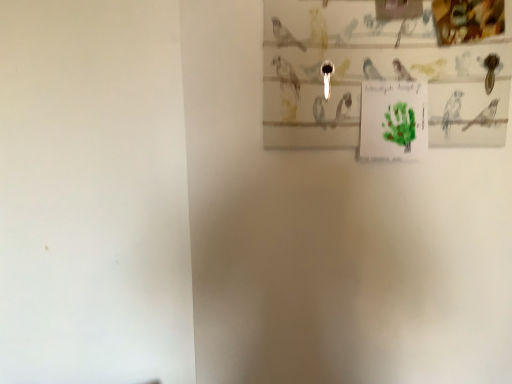
The image size is (512, 384). What do you see at coordinates (393, 120) in the screenshot?
I see `green paper at upper center` at bounding box center [393, 120].

Locate an element on the screen. green paper at upper center is located at coordinates [x=393, y=120].

What is the approximate width of green paper at upper center?

3.42 centimeters.

What is the approximate width of matte paper picture frame at upper right?

0.83 inches.

Describe the element at coordinates (376, 74) in the screenshot. I see `matte paper picture frame at upper right` at that location.

You are a GUI agent. You are given a task and a screenshot of the screen. Output one action in this format:
    pyautogui.click(x=<x>, y=<y>)
    Task: Click on the matte paper picture frame at upper right
    
    Given the screenshot: What is the action you would take?
    pyautogui.click(x=376, y=74)

Identify the location of green paper at upper center. (393, 120).

In the scene shown: Which is more to the left, green paper at upper center or matte paper picture frame at upper right?

matte paper picture frame at upper right is more to the left.

Which is behind, green paper at upper center or matte paper picture frame at upper right?

green paper at upper center is further from the camera.

Does point (421, 116) appear closer or farther from the camera than point (335, 97)?

Point (421, 116) is closer to the camera than point (335, 97).

From the image's perspective, which is below, green paper at upper center or matte paper picture frame at upper right?

green paper at upper center, from the image's perspective.

From a real-world perspective, is green paper at upper center on top of matte paper picture frame at upper right?

No, from a real-world perspective, green paper at upper center is not on top of matte paper picture frame at upper right.

Does green paper at upper center have a greater width compared to matte paper picture frame at upper right?

Yes, green paper at upper center is wider than matte paper picture frame at upper right.

Is green paper at upper center taller than matte paper picture frame at upper right?

No, green paper at upper center is not taller than matte paper picture frame at upper right.

Who is bigger, green paper at upper center or matte paper picture frame at upper right?

Bigger between the two is matte paper picture frame at upper right.

Is green paper at upper center located outside matte paper picture frame at upper right?

Yes, green paper at upper center is located beyond the bounds of matte paper picture frame at upper right.

Is green paper at upper center far away from matte paper picture frame at upper right?

No, there isn't a large distance between green paper at upper center and matte paper picture frame at upper right.

Could you tell me if green paper at upper center is turned towards matte paper picture frame at upper right?

No, green paper at upper center does not turn towards matte paper picture frame at upper right.

How different are the orientations of green paper at upper center and matte paper picture frame at upper right in degrees?

The facing directions of green paper at upper center and matte paper picture frame at upper right are 0.0117 degrees apart.

How distant is green paper at upper center from matte paper picture frame at upper right?

green paper at upper center is 9.35 centimeters away from matte paper picture frame at upper right.

This screenshot has width=512, height=384. I want to click on picture frame in front of the green paper at upper center, so click(x=376, y=74).

Considering the relative positions of matte paper picture frame at upper right and green paper at upper center in the image provided, is matte paper picture frame at upper right to the left or to the right of green paper at upper center?

Based on their positions, matte paper picture frame at upper right is located to the left of green paper at upper center.

Relative to green paper at upper center, is matte paper picture frame at upper right in front or behind?

matte paper picture frame at upper right is positioned closer to the viewer than green paper at upper center.

Does point (442, 70) come closer to viewer compared to point (389, 101)?

Yes, point (442, 70) is in front of point (389, 101).

From the image's perspective, relative to green paper at upper center, is matte paper picture frame at upper right above or below?

Based on their image positions, matte paper picture frame at upper right is located above green paper at upper center.

From a real-world perspective, which object rests below the other?

In real-world perspective, green paper at upper center is lower.

Does matte paper picture frame at upper right have a greater width compared to green paper at upper center?

In fact, matte paper picture frame at upper right might be narrower than green paper at upper center.

Can you confirm if matte paper picture frame at upper right is taller than green paper at upper center?

Indeed, matte paper picture frame at upper right has a greater height compared to green paper at upper center.

Which of these two, matte paper picture frame at upper right or green paper at upper center, is bigger?

matte paper picture frame at upper right is bigger.

In the scene shown: Is green paper at upper center inside matte paper picture frame at upper right?

No.

Is matte paper picture frame at upper right far from green paper at upper center?

No, there isn't a large distance between matte paper picture frame at upper right and green paper at upper center.

Is matte paper picture frame at upper right aimed at green paper at upper center?

Yes, matte paper picture frame at upper right is aimed at green paper at upper center.

How many degrees apart are the facing directions of matte paper picture frame at upper right and green paper at upper center?

The angle between the facing direction of matte paper picture frame at upper right and the facing direction of green paper at upper center is 0.0117 degrees.

This screenshot has width=512, height=384. Identify the location of postcard below the matte paper picture frame at upper right (from a real-world perspective). (393, 120).

I want to click on postcard to the right of matte paper picture frame at upper right, so click(393, 120).

The image size is (512, 384). I want to click on postcard below the matte paper picture frame at upper right (from a real-world perspective), so click(x=393, y=120).